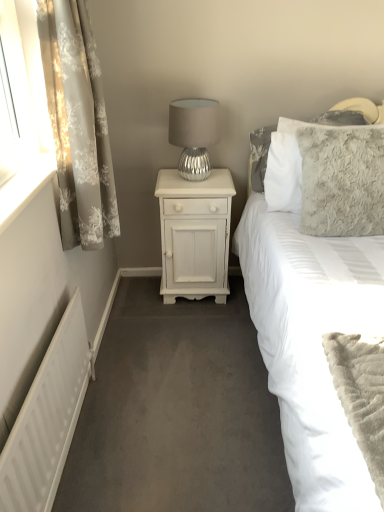
Question: Is white matte radiator at lower left facing away from fluffy gray pillow at upper right?

Choices:
 (A) no
 (B) yes

Answer: (A)

Question: From a real-world perspective, is white matte radiator at lower left located beneath fluffy gray pillow at upper right?

Choices:
 (A) yes
 (B) no

Answer: (A)

Question: From the image's perspective, is white matte radiator at lower left located above fluffy gray pillow at upper right?

Choices:
 (A) no
 (B) yes

Answer: (A)

Question: Considering the relative sizes of white matte radiator at lower left and fluffy gray pillow at upper right in the image provided, is white matte radiator at lower left bigger than fluffy gray pillow at upper right?

Choices:
 (A) yes
 (B) no

Answer: (B)

Question: Does white matte radiator at lower left contain fluffy gray pillow at upper right?

Choices:
 (A) no
 (B) yes

Answer: (A)

Question: Can you confirm if white matte radiator at lower left is smaller than fluffy gray pillow at upper right?

Choices:
 (A) no
 (B) yes

Answer: (B)

Question: Is floral sheer curtain at left positioned behind white painted wood nightstand at center?

Choices:
 (A) no
 (B) yes

Answer: (A)

Question: Can we say floral sheer curtain at left lies outside white painted wood nightstand at center?

Choices:
 (A) yes
 (B) no

Answer: (A)

Question: Is floral sheer curtain at left taller than white painted wood nightstand at center?

Choices:
 (A) yes
 (B) no

Answer: (A)

Question: Does floral sheer curtain at left have a smaller size compared to white painted wood nightstand at center?

Choices:
 (A) yes
 (B) no

Answer: (A)

Question: Is floral sheer curtain at left looking in the opposite direction of white painted wood nightstand at center?

Choices:
 (A) no
 (B) yes

Answer: (A)

Question: From the image's perspective, is floral sheer curtain at left above white painted wood nightstand at center?

Choices:
 (A) no
 (B) yes

Answer: (B)

Question: Considering the relative positions of fluffy gray pillow at upper right and fluffy gray pillow at upper right in the image provided, is fluffy gray pillow at upper right to the left of fluffy gray pillow at upper right from the viewer's perspective?

Choices:
 (A) no
 (B) yes

Answer: (B)